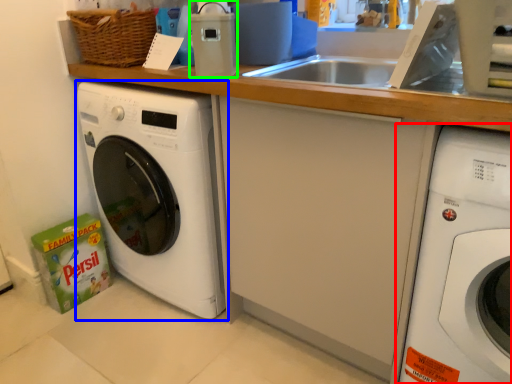
Question: Which is nearer to the washing machine (highlighted by a red box)? washing machine (highlighted by a blue box) or appliance (highlighted by a green box).

Choices:
 (A) washing machine
 (B) appliance

Answer: (B)